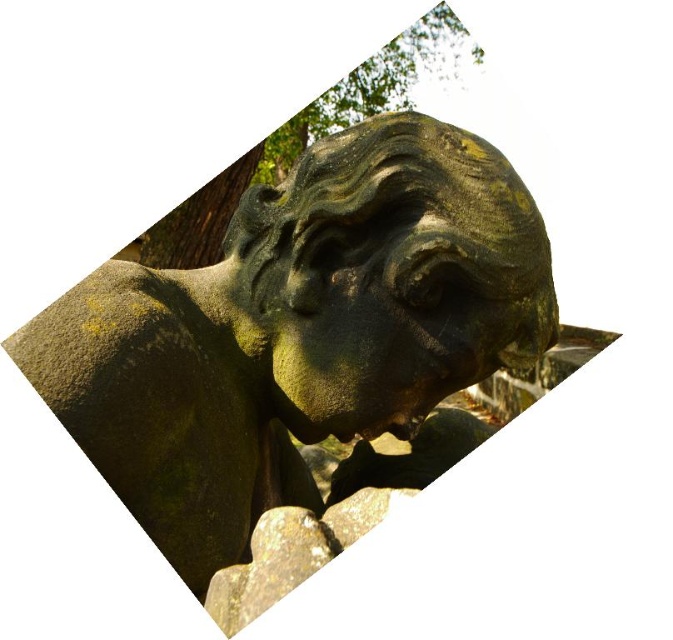
Is point (38, 342) positioned before point (236, 196)?

That is True.

Find the location of `green stone statue at center`. green stone statue at center is located at coordinates (295, 330).

Image resolution: width=673 pixels, height=640 pixels. What are the coordinates of `green stone statue at center` in the screenshot? It's located at (295, 330).

The height and width of the screenshot is (640, 673). I want to click on green stone statue at center, so click(295, 330).

Is green stone statue at center bigger than green mossy stone head at center?

Yes, green stone statue at center is bigger than green mossy stone head at center.

Between green stone statue at center and green mossy stone head at center, which one is positioned higher?

Positioned higher is green mossy stone head at center.

Who is more forward, (139, 456) or (316, 358)?

Point (139, 456)

Where is `green stone statue at center`? The height and width of the screenshot is (640, 673). green stone statue at center is located at coordinates (295, 330).

Is green mossy stone head at center below green mossy tree at upper center?

Indeed, green mossy stone head at center is positioned under green mossy tree at upper center.

Can you confirm if green mossy stone head at center is wider than green mossy tree at upper center?

No, green mossy stone head at center is not wider than green mossy tree at upper center.

Between point (369, 420) and point (227, 193), which one is positioned behind?

The point (227, 193) is more distant.

This screenshot has height=640, width=673. Find the location of `green mossy stone head at center`. green mossy stone head at center is located at coordinates (386, 276).